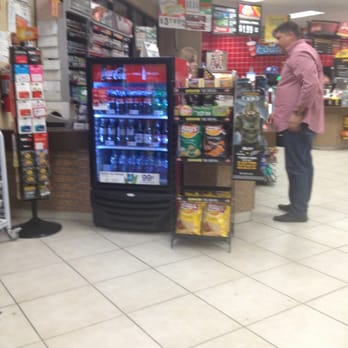
Find the location of `empty space of floor tiles in foreground`. empty space of floor tiles in foreground is located at coordinates (68, 294), (175, 300), (307, 282).